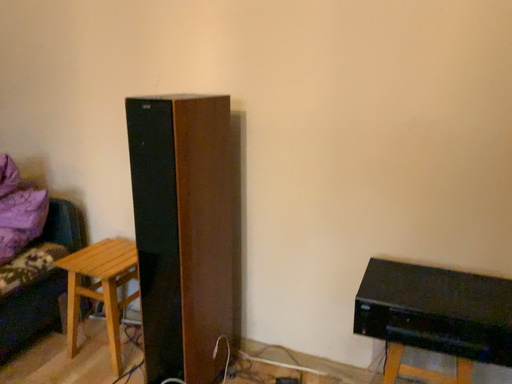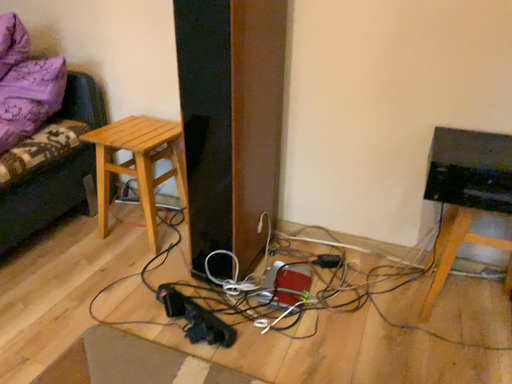
Question: How did the camera likely rotate when shooting the video?

Choices:
 (A) rotated upward
 (B) rotated downward

Answer: (B)